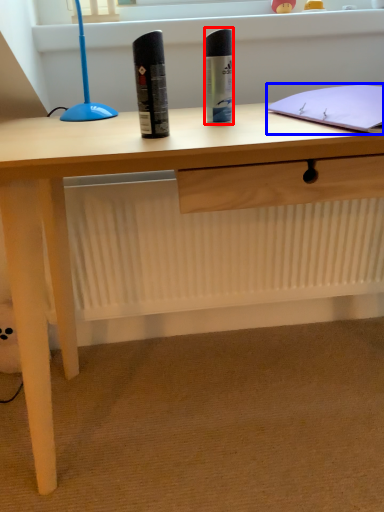
Question: Among these objects, which one is nearest to the camera, stationery (highlighted by a red box) or notebook (highlighted by a blue box)?

Choices:
 (A) stationery
 (B) notebook

Answer: (B)